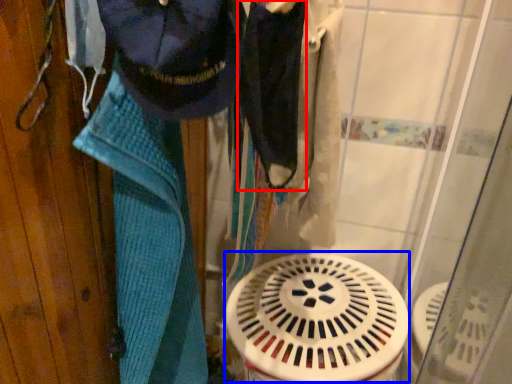
Question: Which object appears farthest to the camera in this image, clothing (highlighted by a red box) or water heater (highlighted by a blue box)?

Choices:
 (A) clothing
 (B) water heater

Answer: (B)